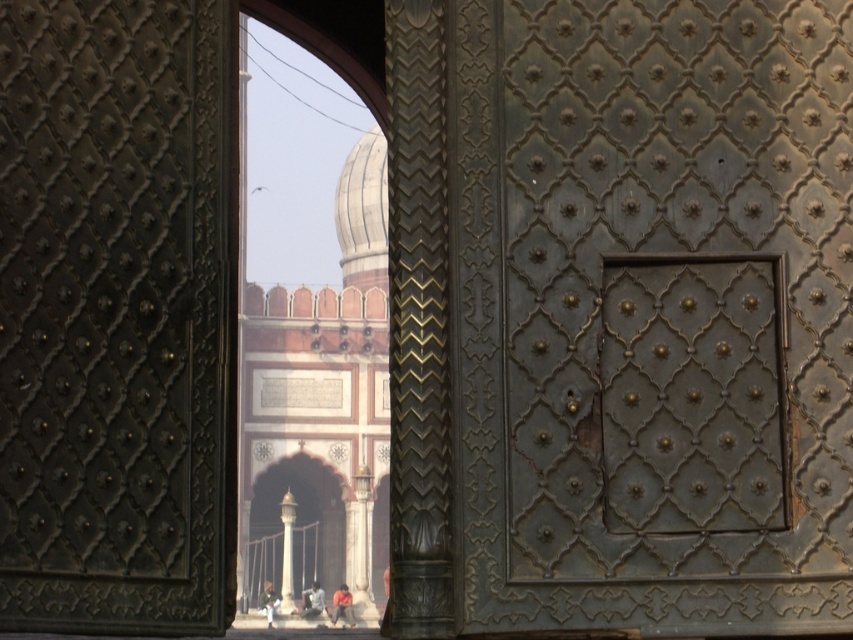
Which of these two, dark gray metal door at center or light brown leather jacket at center, stands shorter?

light brown leather jacket at center

Who is taller, dark gray metal door at center or light brown leather jacket at center?

With more height is dark gray metal door at center.

Locate an element on the screen. This screenshot has height=640, width=853. dark gray metal door at center is located at coordinates (653, 314).

In order to click on dark gray metal door at center in this screenshot , I will do `click(653, 314)`.

Can you confirm if dark gray metal door at center is shorter than dark gray fabric man at center?

No, dark gray metal door at center is not shorter than dark gray fabric man at center.

How much distance is there between dark gray metal door at center and dark gray fabric man at center?

dark gray metal door at center and dark gray fabric man at center are 483.34 feet apart.

Is point (608, 4) farther from viewer compared to point (312, 580)?

No, it is not.

The width and height of the screenshot is (853, 640). I want to click on dark gray metal door at center, so click(653, 314).

Is dark brown leather pants at center positioned behind dark gray fabric man at center?

No, it is in front of dark gray fabric man at center.

Who is more forward, (351, 598) or (314, 588)?

Point (351, 598) is in front.

Image resolution: width=853 pixels, height=640 pixels. What are the coordinates of `dark brown leather pants at center` in the screenshot? It's located at (341, 605).